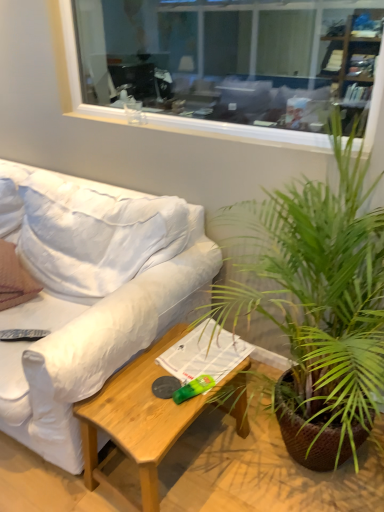
Identify the location of free space to the right of light brown wood coffee table at lower center. (266, 478).